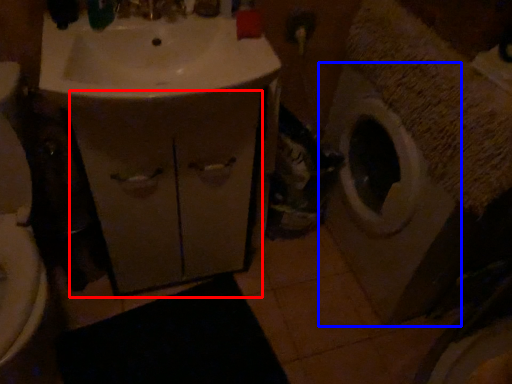
Question: Among these objects, which one is nearest to the camera, drawer (highlighted by a red box) or washing machine (highlighted by a blue box)?

Choices:
 (A) drawer
 (B) washing machine

Answer: (B)